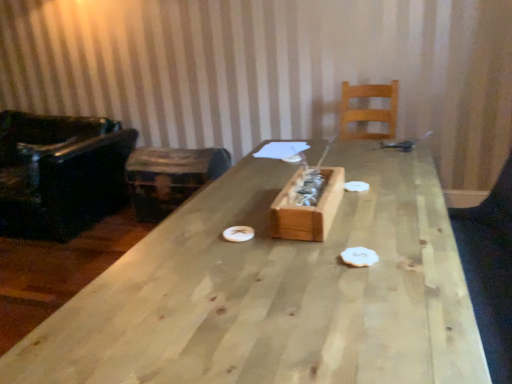
Question: Is white matte paper plate at center, marked as the second paper plate in a right-to-left arrangement, taller or shorter than wooden box at center?

Choices:
 (A) tall
 (B) short

Answer: (B)

Question: Do you think white matte paper plate at center, which is counted as the 2th paper plate, starting from the top, is within wooden box at center, or outside of it?

Choices:
 (A) inside
 (B) outside

Answer: (B)

Question: Estimate the real-world distances between objects in this image. Which object is farther from the black leather chair at left, positioned as the second chair in right-to-left order?

Choices:
 (A) natural wood table at center
 (B) white matte paper plate at center, the 2th paper plate viewed from the front
 (C) white matte paper plate at center, the 1th paper plate when ordered from left to right
 (D) light wood chair at upper right, the second chair positioned from the left
 (E) wooden box at center

Answer: (B)

Question: Which object is positioned farthest from the black leather chair at left, which ranks as the first chair in left-to-right order?

Choices:
 (A) light wood chair at upper right, the second chair positioned from the left
 (B) wooden trunk at left
 (C) natural wood table at center
 (D) white matte paper plate at center, marked as the second paper plate in a right-to-left arrangement
 (E) white matte paper plate at center, which appears as the first paper plate when viewed from the right

Answer: (E)